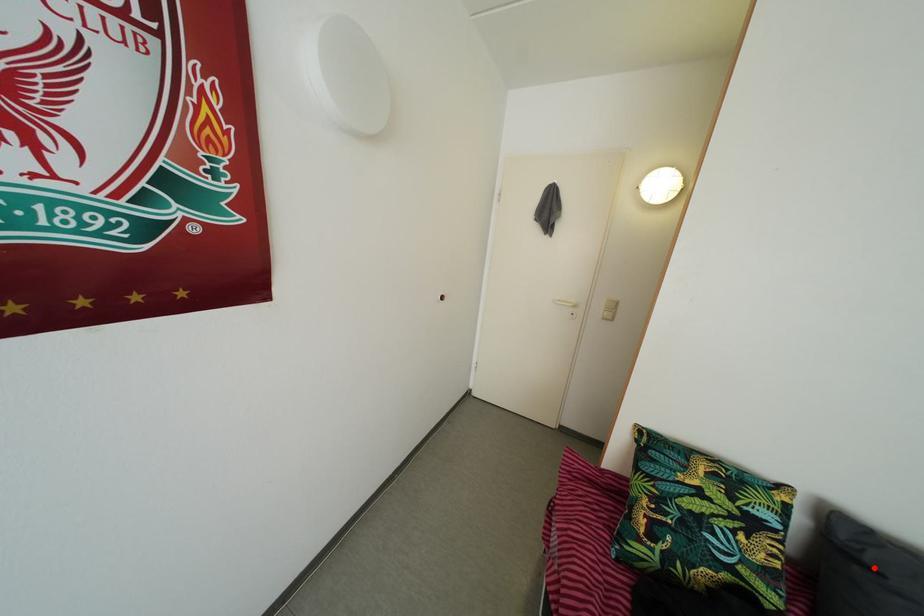
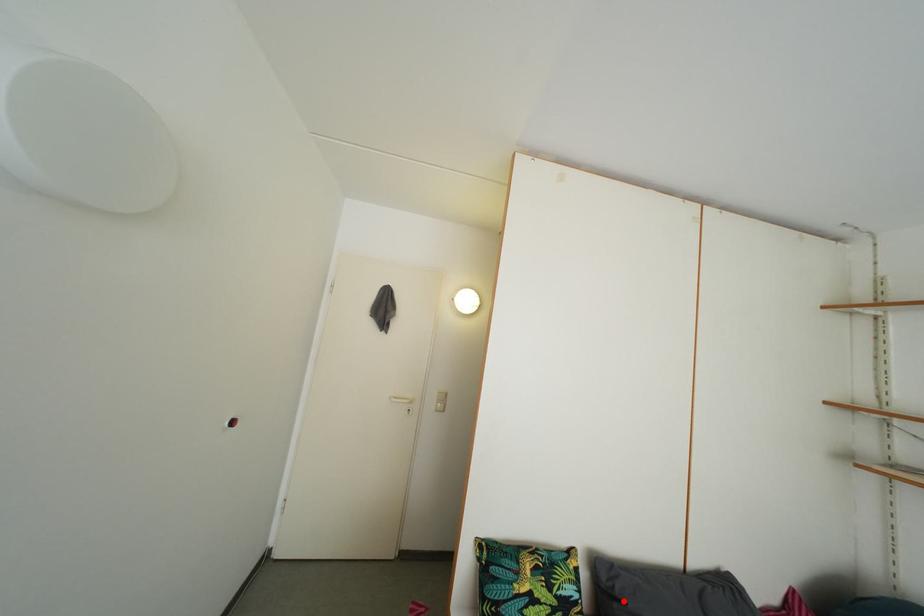
I am providing you with two images of the same scene from different viewpoints. A red point is marked on the first image and another point is marked on the second image. Do the highlighted points in image1 and image2 indicate the same real-world spot?

Yes